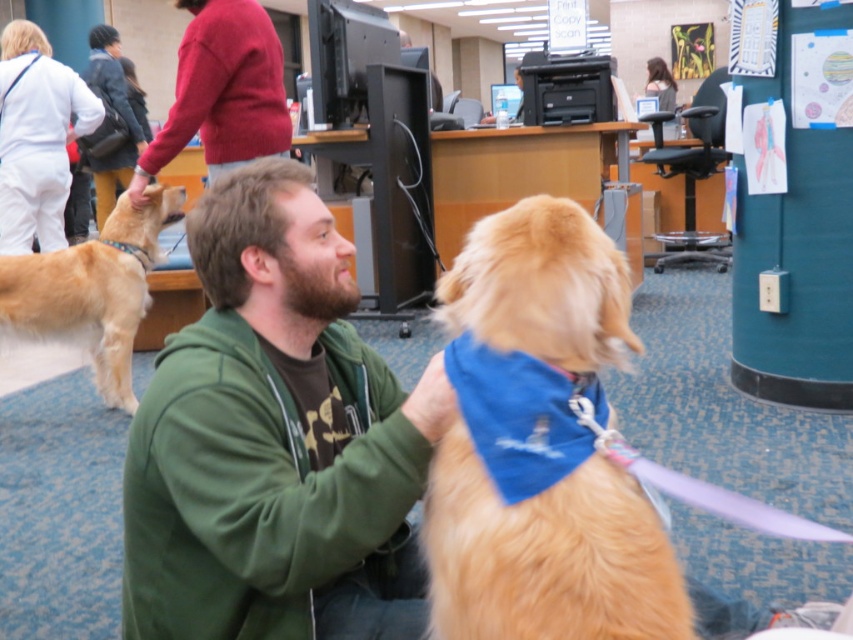
In the scene shown: What is located at the coordinates point (547,556)?

The golden fur dog at center is located at point (547,556).